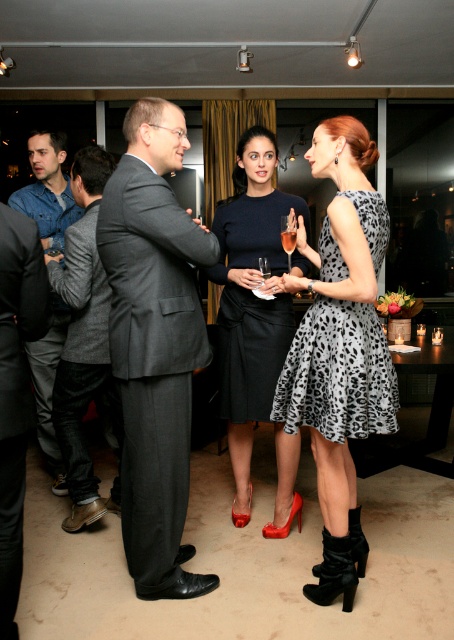
Is matte black dress at center further to camera compared to leopard print dress at center?

Yes, matte black dress at center is behind leopard print dress at center.

Who is more distant from viewer, [290,200] or [384,364]?

Positioned behind is point [290,200].

At what (x,y) coordinates should I click in order to perform the action: click on matte black dress at center. Please return your answer as a coordinate pair (x, y). Image resolution: width=454 pixels, height=640 pixels. Looking at the image, I should click on (251, 301).

Who is positioned more to the right, gray wool suit at center or denim jacket at left?

Positioned to the right is gray wool suit at center.

Does gray wool suit at center appear on the right side of denim jacket at left?

Yes, gray wool suit at center is to the right of denim jacket at left.

Who is more forward, (95, 321) or (28, 348)?

Point (95, 321) is in front.

Identify the location of gray wool suit at center. This screenshot has width=454, height=640. (83, 337).

Based on the photo, can you confirm if gray pinstripe suit at center is smaller than gray wool suit at center?

Incorrect, gray pinstripe suit at center is not smaller in size than gray wool suit at center.

The width and height of the screenshot is (454, 640). Find the location of `gray pinstripe suit at center`. gray pinstripe suit at center is located at coordinates (154, 342).